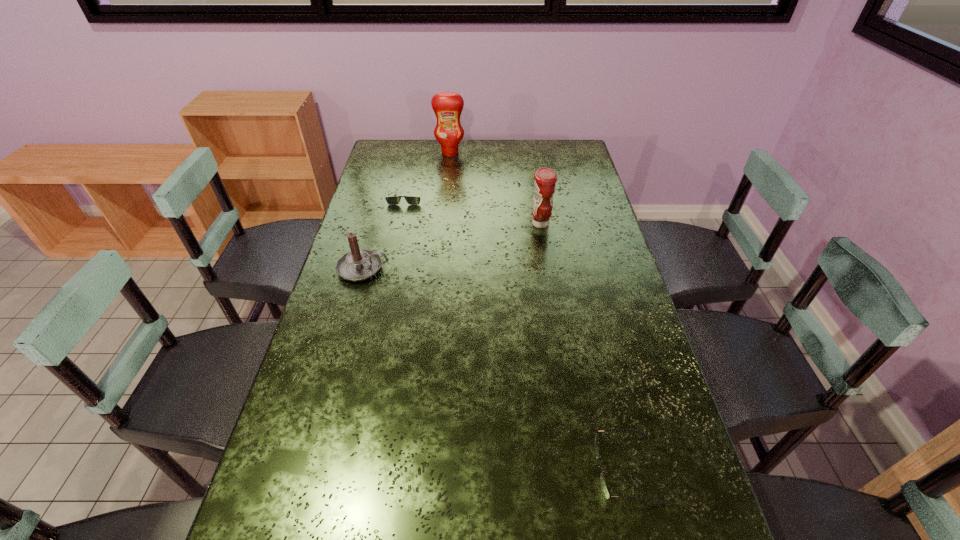
At what (x,y) coordinates should I click in order to perform the action: click on free space located 0.140m on the side of the second nearest object with the handle loop. Please return your answer as a coordinate pair (x, y). This screenshot has height=540, width=960. Looking at the image, I should click on (433, 268).

This screenshot has height=540, width=960. In order to click on vacant space located on the front-facing side of the sunglasses in this screenshot , I will do `click(394, 252)`.

Where is `vacant area situated 0.200m on the front-facing side of the spectacles`? Image resolution: width=960 pixels, height=540 pixels. vacant area situated 0.200m on the front-facing side of the spectacles is located at coordinates (503, 469).

Locate an element on the screen. free space located on the front-facing side of the spectacles is located at coordinates (545, 469).

This screenshot has width=960, height=540. In order to click on blank space located 0.240m on the front-facing side of the spectacles in this screenshot , I will do `click(484, 469)`.

What are the coordinates of `object at the far edge` in the screenshot? It's located at (447, 106).

Image resolution: width=960 pixels, height=540 pixels. Identify the location of candle that is at the left edge. (360, 264).

Locate an element on the screen. sunglasses present at the left edge is located at coordinates (393, 200).

You are a GUI agent. You are given a task and a screenshot of the screen. Output one action in this format:
    pyautogui.click(x=<x>, y=<y>)
    Task: Click on the object situated at the right edge
    Image resolution: width=960 pixels, height=540 pixels.
    Given the screenshot: What is the action you would take?
    pyautogui.click(x=603, y=482)

At what (x,y) coordinates should I click in order to perform the action: click on vacant space at the far edge of the desktop. Please return your answer as a coordinate pair (x, y). Looking at the image, I should click on 515,151.